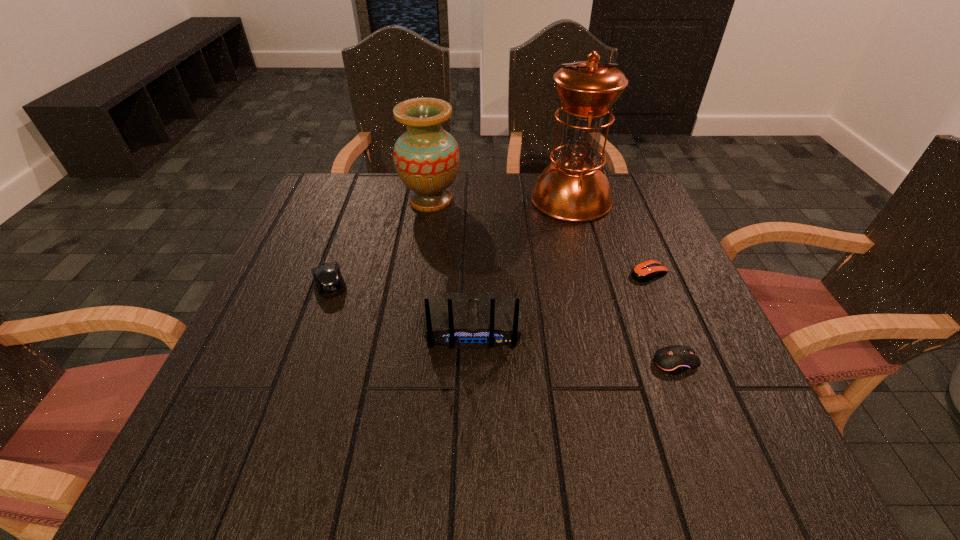
Locate an element on the screen. The height and width of the screenshot is (540, 960). free area in between the router and the tallest object is located at coordinates (522, 262).

Locate an element on the screen. vacant space that's between the oil lamp and the fifth tallest object is located at coordinates (623, 281).

You are a GUI agent. You are given a task and a screenshot of the screen. Output one action in this format:
    pyautogui.click(x=<x>, y=<y>)
    Task: Click on the free area in between the shortest computer mouse and the oil lamp
    This screenshot has height=540, width=960.
    Given the screenshot: What is the action you would take?
    pyautogui.click(x=610, y=236)

The width and height of the screenshot is (960, 540). In order to click on vacant space that's between the leftmost computer mouse and the vase in this screenshot , I will do `click(380, 242)`.

What are the coordinates of `free space that is in between the vase and the third tallest object` in the screenshot? It's located at (452, 263).

Select which object appears as the closest to the tallest object. Please provide its 2D coordinates. Your answer should be formatted as a tuple, i.e. [(x, y)], where the tuple contains the x and y coordinates of a point satisfying the conditions above.

[(645, 271)]

Find the location of `object that is the fifth closest one to the leftmost object`. object that is the fifth closest one to the leftmost object is located at coordinates (645, 271).

Locate an element on the screen. The width and height of the screenshot is (960, 540). computer mouse that is the second nearest to the shortest object is located at coordinates (329, 281).

Point out which computer mouse is positioned as the second nearest to the shortest computer mouse. Please provide its 2D coordinates. Your answer should be formatted as a tuple, i.e. [(x, y)], where the tuple contains the x and y coordinates of a point satisfying the conditions above.

[(329, 281)]

I want to click on vacant space that satisfies the following two spatial constraints: 1. on the front side of the vase; 2. on the right side of the second shortest computer mouse, so click(407, 363).